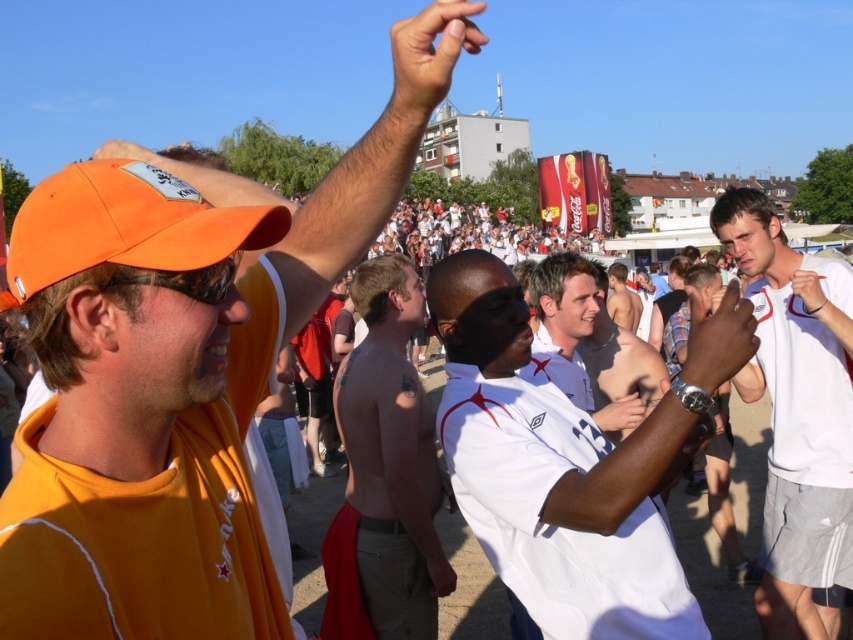
Can you confirm if orange matte cap at upper left is wider than matte white shirt at center?

Yes, orange matte cap at upper left is wider than matte white shirt at center.

In order to click on orange matte cap at upper left in this screenshot , I will do `click(163, 390)`.

The height and width of the screenshot is (640, 853). I want to click on orange matte cap at upper left, so click(163, 390).

Which is behind, point (370, 275) or point (439, 52)?

The point (370, 275) is more distant.

Does shiny metallic belt at center have a greater height compared to matte orange cap at upper center?

Yes, shiny metallic belt at center is taller than matte orange cap at upper center.

Is point (413, 600) less distant than point (456, 44)?

No, it is not.

Find the location of `shiny metallic belt at center`. shiny metallic belt at center is located at coordinates (386, 474).

From the picture: Does white matte shirt at center have a larger size compared to matte black hand at center?

Indeed, white matte shirt at center has a larger size compared to matte black hand at center.

Which is behind, point (463, 269) or point (746, 307)?

Positioned behind is point (463, 269).

Measure the distance between point (605,502) and camera.

Point (605,502) and camera are 16.98 meters apart from each other.

What are the coordinates of `white matte shirt at center` in the screenshot? It's located at (567, 465).